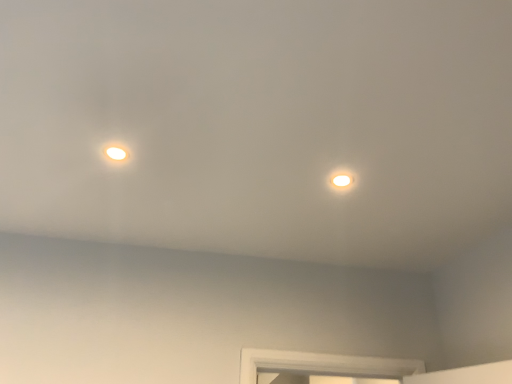
Question: In the image, is matte white light at upper right on the left side or the right side of matte white droplight at upper left?

Choices:
 (A) right
 (B) left

Answer: (A)

Question: From a real-world perspective, relative to matte white droplight at upper left, is matte white light at upper right vertically above or below?

Choices:
 (A) above
 (B) below

Answer: (A)

Question: Looking at their shapes, would you say matte white light at upper right is wider or thinner than matte white droplight at upper left?

Choices:
 (A) wide
 (B) thin

Answer: (B)

Question: In the image, is matte white droplight at upper left positioned in front of or behind matte white light at upper right?

Choices:
 (A) behind
 (B) front

Answer: (B)

Question: Is matte white droplight at upper left to the left or to the right of matte white light at upper right in the image?

Choices:
 (A) right
 (B) left

Answer: (B)

Question: Is point (113, 162) positioned closer to the camera than point (342, 180)?

Choices:
 (A) farther
 (B) closer

Answer: (B)

Question: From their relative heights in the image, would you say matte white droplight at upper left is taller or shorter than matte white light at upper right?

Choices:
 (A) tall
 (B) short

Answer: (A)